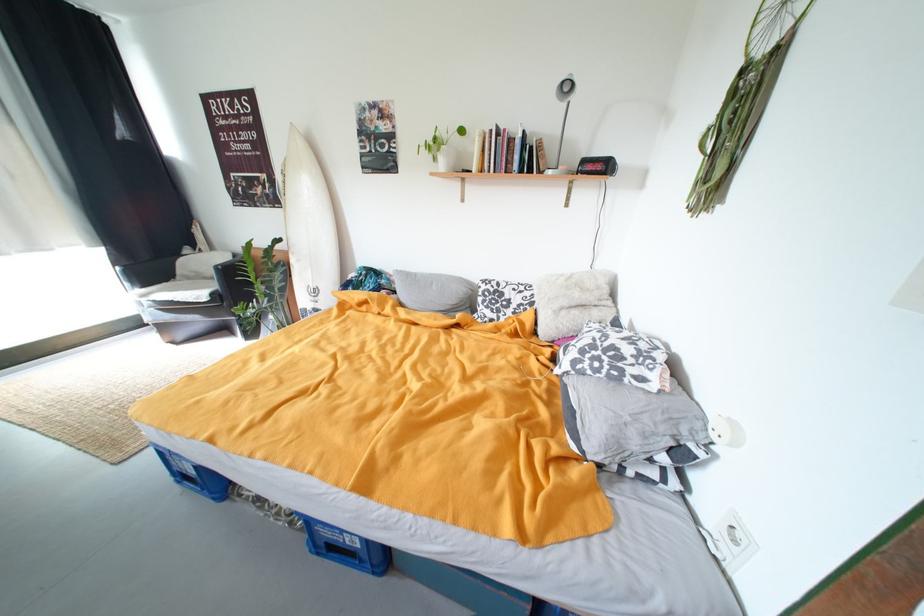
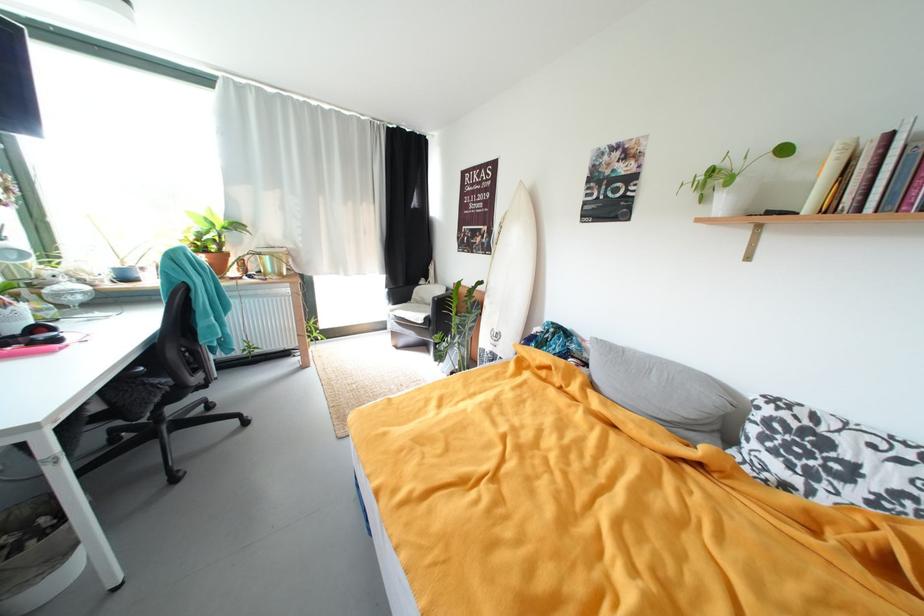
Question: The images are taken continuously from a first-person perspective. In which direction is your viewpoint rotating?

Choices:
 (A) Left
 (B) Right
 (C) Up
 (D) Down

Answer: (A)